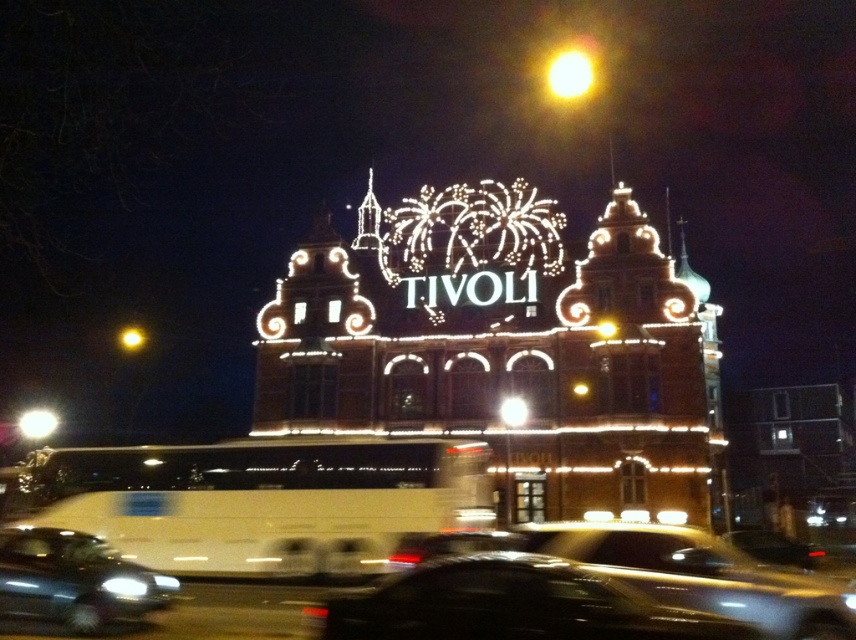
Based on the photo, you are a photographer who just took a picture of TIVOLI building at night. You want to know the location of the shiny black sedan at lower left in the image. Where exactly is it located in the image?

The shiny black sedan at lower left is located at point (74,580) in the image.

Based on the photo, you are a delivery driver who needs to park your car between the black glossy car at lower center and the shiny black sedan at lower left. The parking spot between them can accommodate cars up to 20 meters long. Can your 18.5 meter long delivery van fit in this space?

The distance between the black glossy car at lower center and the shiny black sedan at lower left is 20.98 meters. Since your delivery van is 18.5 meters long, it can fit in the available space as there is enough length between them.